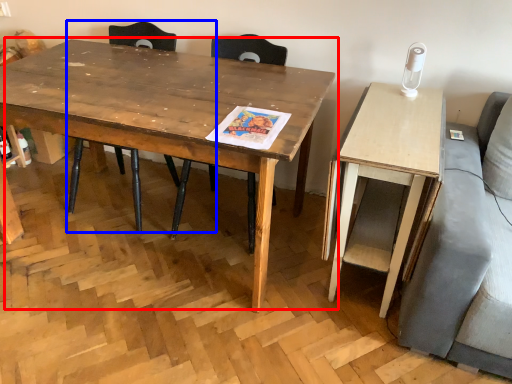
Question: Which of the following is the farthest to the observer, coffee table (highlighted by a red box) or chair (highlighted by a blue box)?

Choices:
 (A) coffee table
 (B) chair

Answer: (B)